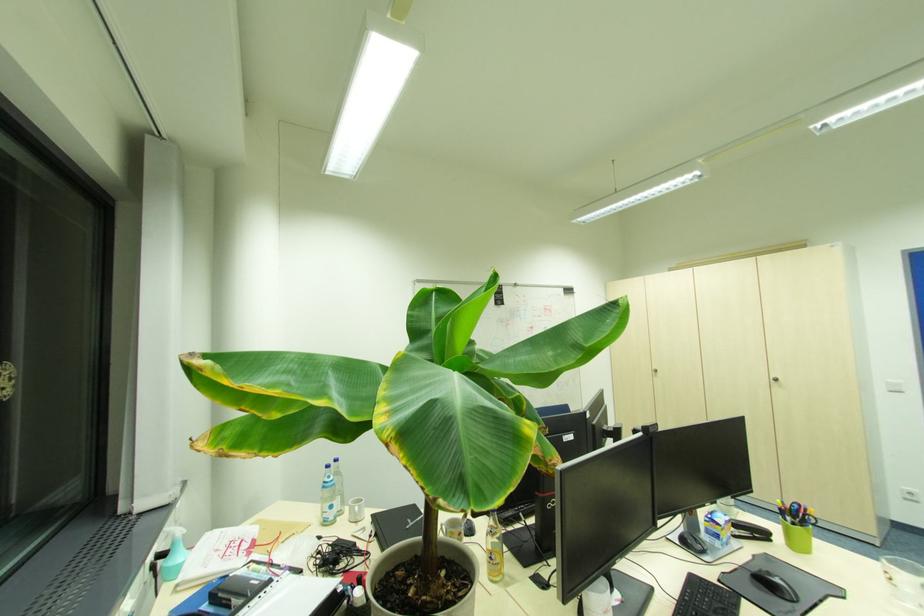
Which object does [749,531] point to?

This point indicates the black stapler.